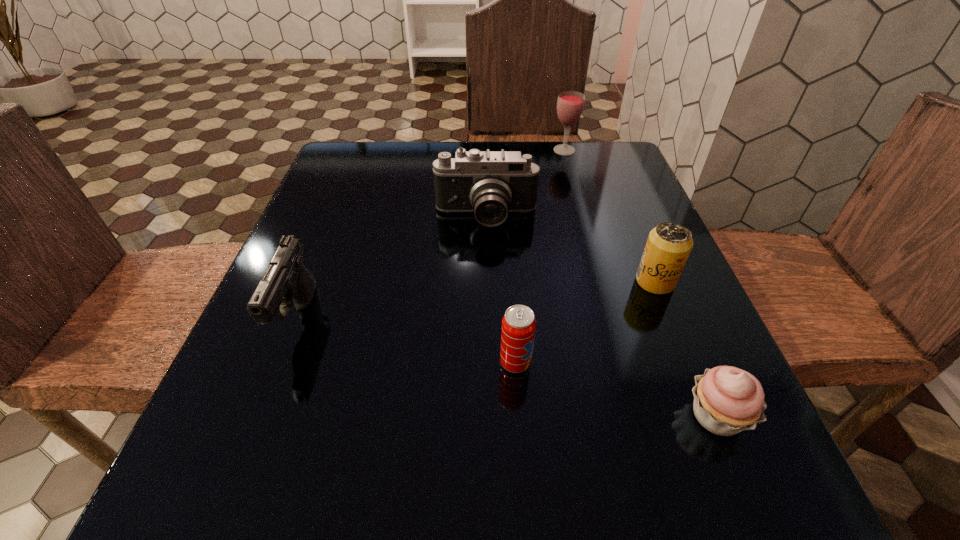
Where is `vacant space located on the front of the beer can`? This screenshot has height=540, width=960. vacant space located on the front of the beer can is located at coordinates (684, 350).

Locate an element on the screen. vacant area situated on the front of the soda can is located at coordinates (520, 440).

Where is `blank space located on the back of the nearest object`? The height and width of the screenshot is (540, 960). blank space located on the back of the nearest object is located at coordinates (648, 253).

Locate an element on the screen. This screenshot has height=540, width=960. object that is at the far edge is located at coordinates (570, 104).

The image size is (960, 540). I want to click on object at the left edge, so click(287, 279).

The height and width of the screenshot is (540, 960). What are the coordinates of `wineglass that is at the right edge` in the screenshot? It's located at (570, 104).

Identify the location of beer can located at the right edge. (668, 246).

Locate an element on the screen. cupcake positioned at the right edge is located at coordinates (727, 400).

At what (x,y) coordinates should I click in order to perform the action: click on object situated at the far right corner. Please return your answer as a coordinate pair (x, y). Looking at the image, I should click on (570, 104).

Where is `vacant space at the far edge`? vacant space at the far edge is located at coordinates [404, 148].